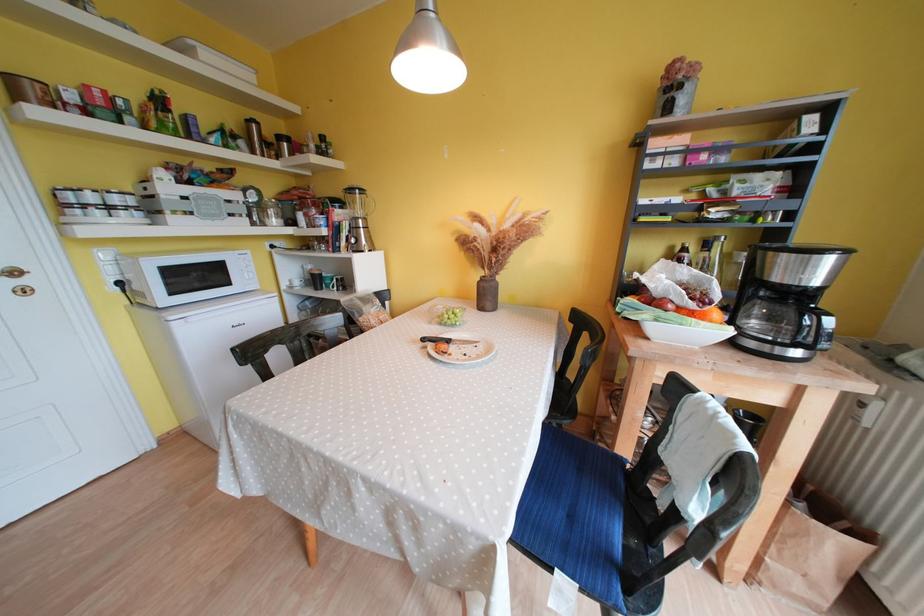
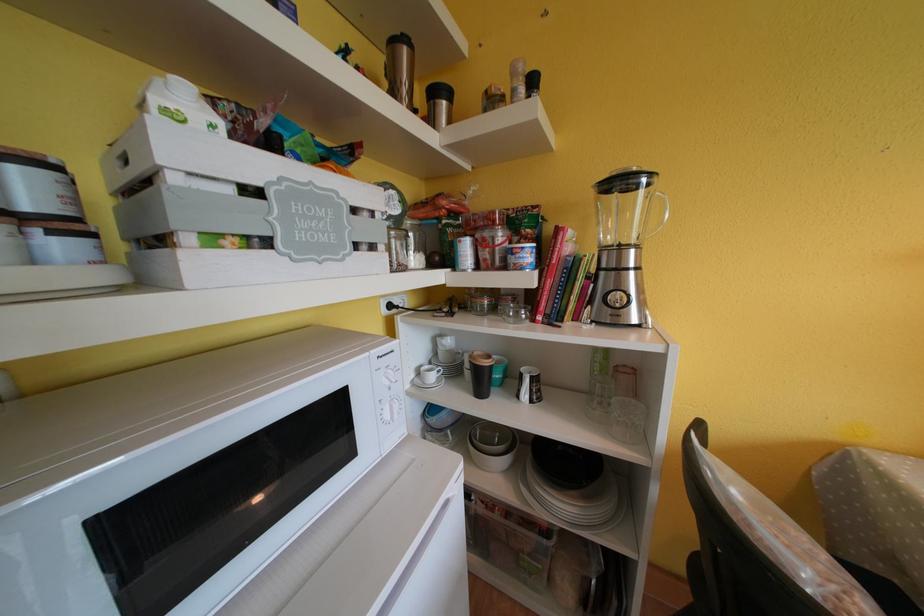
Find the pixel in the second image that matches (x=253, y=124) in the first image.

(399, 46)